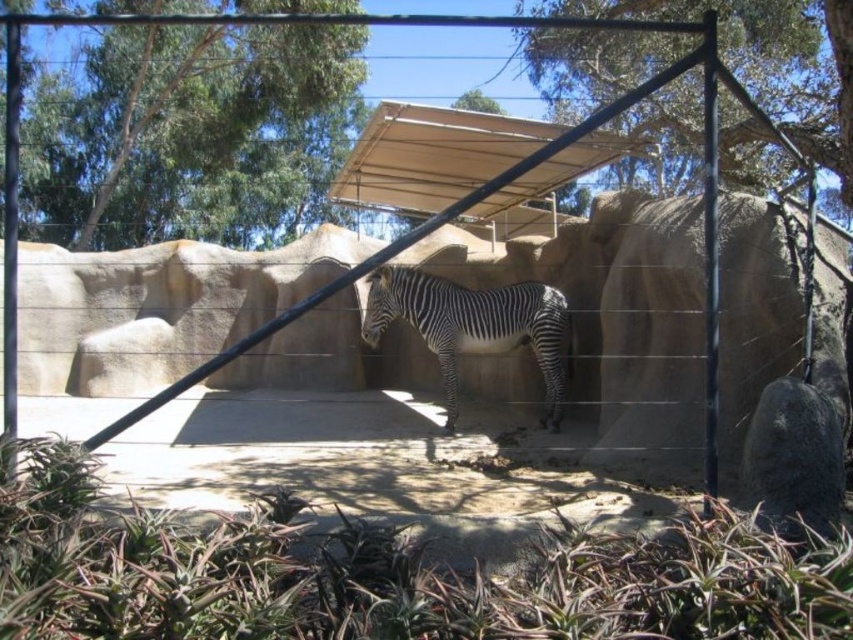
You are a zookeeper trying to water the green leafy tree at upper left and the green leafy tree at upper center. Which tree should you water first if you want to start with the one closer to you?

You should water the green leafy tree at upper left first because it is closer to you than the green leafy tree at upper center.

Based on the photo, you are a visitor at the zoo and want to take a photo of the black and white striped zebra at center. However, there is a green leafy tree at upper left in the way. Can you move closer to the zebra to avoid the tree blocking your view?

The green leafy tree at upper left is further to the viewer than the black and white striped zebra at center, so moving closer to the zebra would bring it between you and the tree, potentially allowing you to avoid the tree blocking the view.